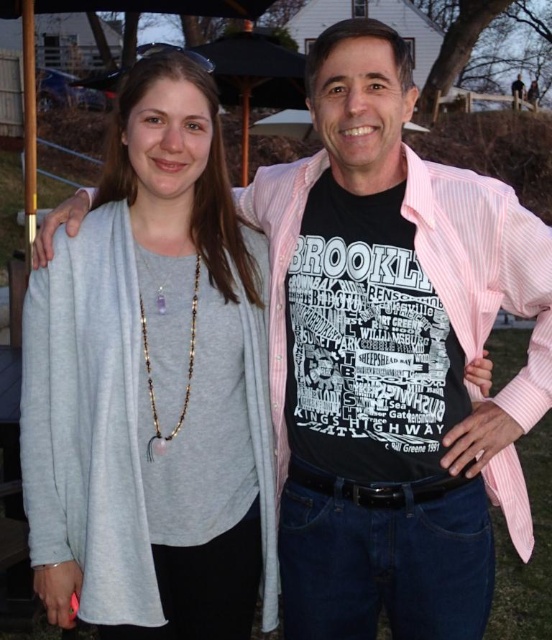
You are a fashion designer working on a new collection. You have two items in front of you, the gray soft sweater at center and the amber beaded necklace at center. You need to decide which item will take up more horizontal space when displayed on a mannequin. Which item should you expect to occupy more width?

The gray soft sweater at center has a greater width than the amber beaded necklace at center, so it will occupy more horizontal space when displayed on a mannequin.

You are a photographer trying to focus on the gray soft sweater at center and the amber beaded necklace at center. Which object should you adjust your camera to focus on first if you want to capture both in the same frame?

The gray soft sweater at center is in front of the amber beaded necklace at center, so you should focus on the gray soft sweater at center first to ensure both are in focus.

You are a photographer setting up for a portrait shoot and need to ensure that both the gray soft sweater at center and the amber beaded necklace at center are clearly visible in the frame. Based on their positions, which object should you focus on first to ensure both are in focus?

The gray soft sweater at center is positioned on the left side of amber beaded necklace at center. To ensure both are in focus, you should focus on the gray soft sweater at center first since it is closer to the left edge and adjusting focus from there can help capture both objects within the depth of field.